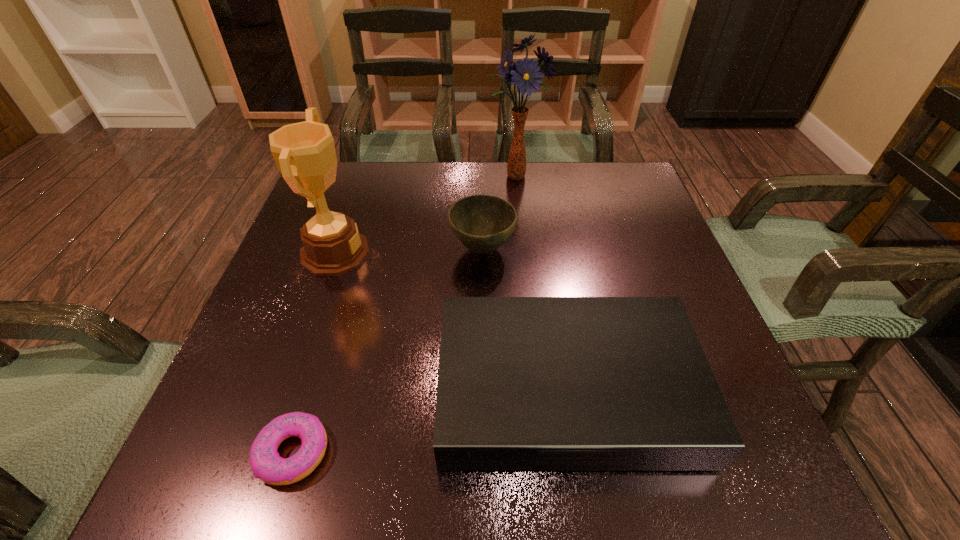
Locate an element on the screen. flower arrangement is located at coordinates (525, 74).

At what (x,y) coordinates should I click in order to perform the action: click on the tallest object. Please return your answer as a coordinate pair (x, y). Looking at the image, I should click on (525, 74).

The width and height of the screenshot is (960, 540). Find the location of `the second tallest object`. the second tallest object is located at coordinates (304, 152).

This screenshot has width=960, height=540. Find the location of `bowl`. bowl is located at coordinates (482, 223).

Identify the location of CD player. (525, 383).

In order to click on the shortest object in this screenshot , I will do `click(265, 462)`.

I want to click on free space located 0.230m on the left of the farthest object, so click(x=404, y=177).

This screenshot has height=540, width=960. In order to click on free space located 0.220m on the front-facing side of the award in this screenshot , I will do `click(466, 253)`.

I want to click on vacant space located 0.360m on the front of the bowl, so click(484, 429).

Locate an element on the screen. The width and height of the screenshot is (960, 540). vacant space located on the left of the doughnut is located at coordinates (199, 452).